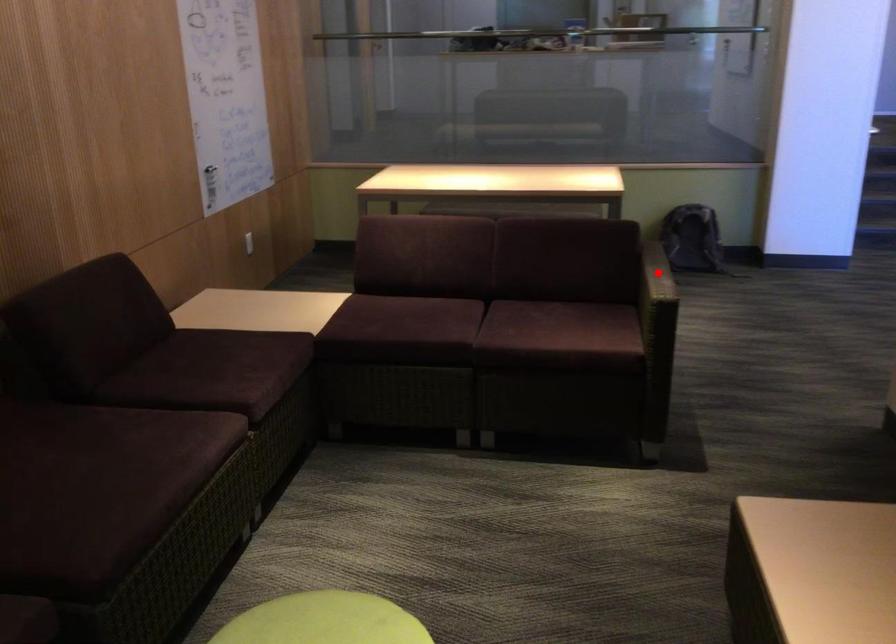
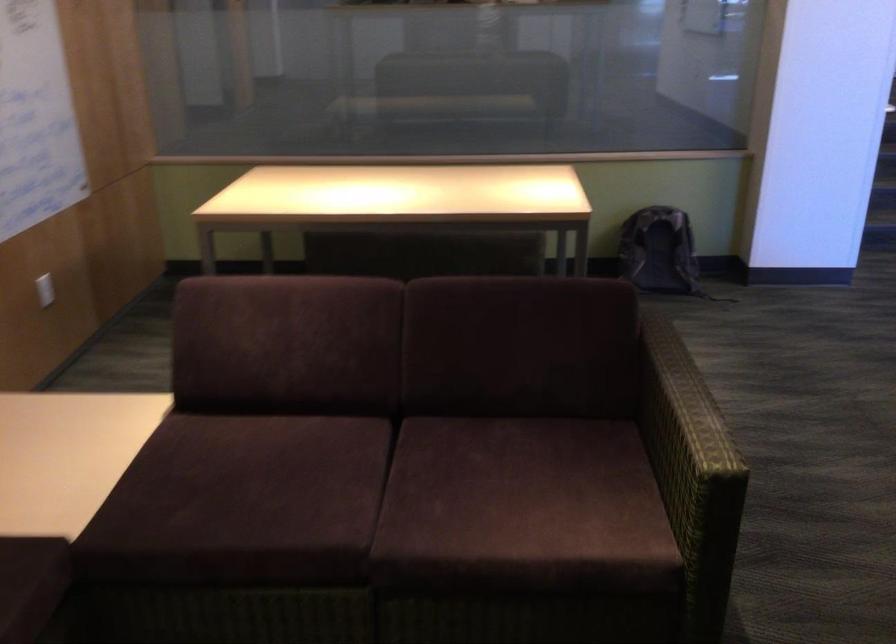
Question: I am providing you with two images of the same scene from different viewpoints. Given a red point in image1, look at the same physical point in image2. Is it:

Choices:
 (A) Closer to the viewpoint
 (B) Farther from the viewpoint

Answer: (A)